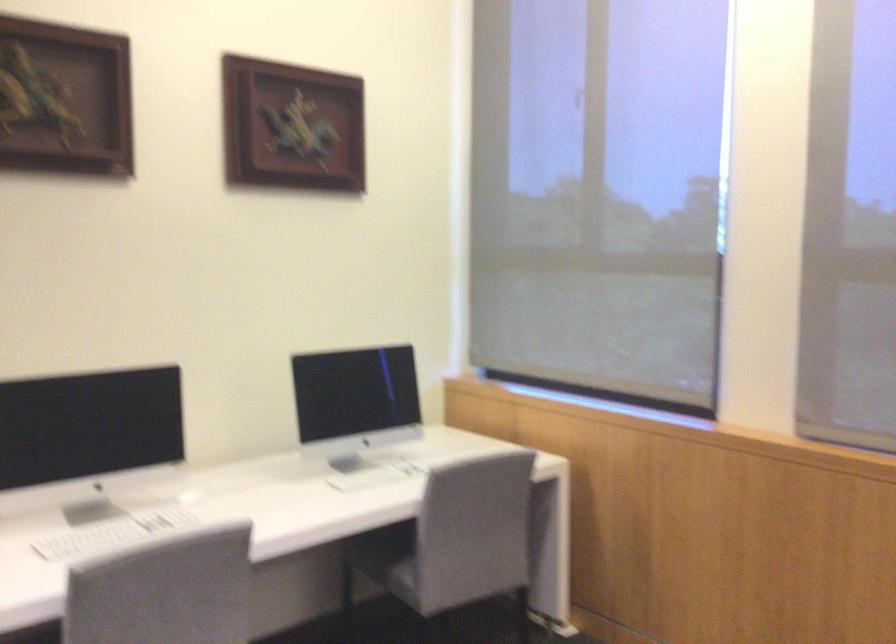
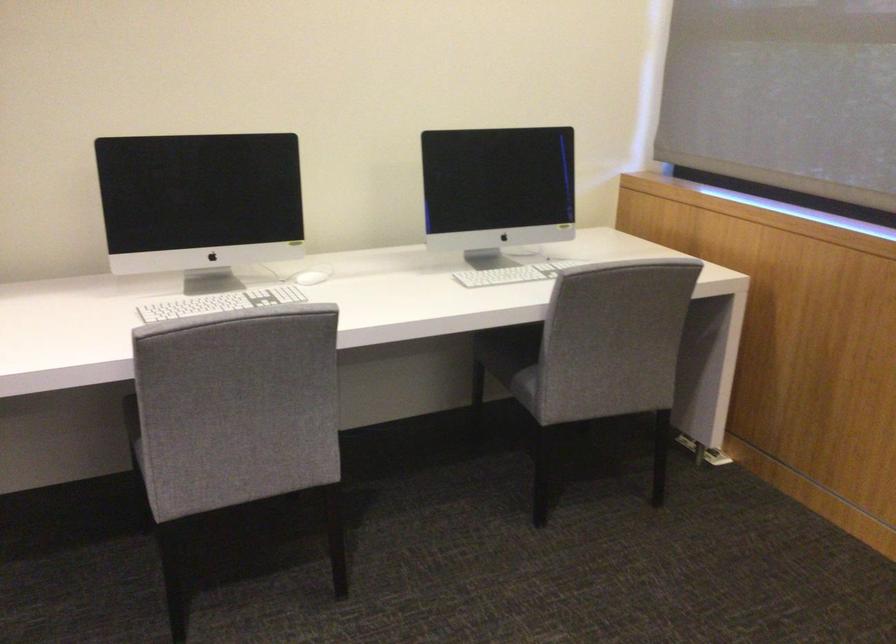
In the second image, find the point that corresponds to the point at 127,527 in the first image.

(220, 303)